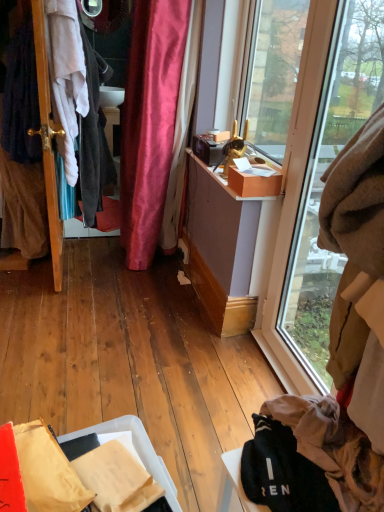
Question: From a real-world perspective, is dark gray fabric at left, arranged as the 1th clothing when viewed from the top, above or below wooden door at left?

Choices:
 (A) below
 (B) above

Answer: (B)

Question: From their relative heights in the image, would you say dark gray fabric at left, arranged as the 1th clothing when viewed from the top, is taller or shorter than wooden door at left?

Choices:
 (A) short
 (B) tall

Answer: (A)

Question: Which object is the closest to the matte brown box at upper right?

Choices:
 (A) matte cardboard box at upper right
 (B) wooden door at left
 (C) clear glass window at right
 (D) brown fuzzy blanket at upper right, the second clothing from the left
 (E) dark gray fabric at left, which is counted as the 2th clothing, starting from the right

Answer: (C)

Question: Estimate the real-world distances between objects in this image. Which object is closer to the wooden door at left?

Choices:
 (A) clear glass window at right
 (B) dark gray fabric at left, marked as the 1th clothing in a left-to-right arrangement
 (C) brown fuzzy blanket at upper right, marked as the first clothing in a front-to-back arrangement
 (D) matte brown box at upper right
 (E) matte cardboard box at upper right

Answer: (B)